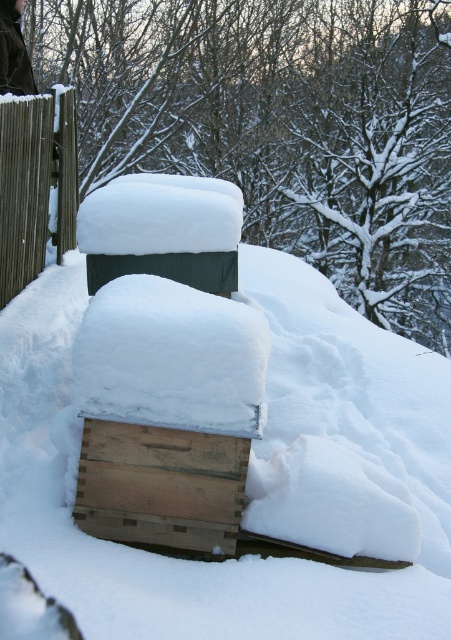
You are a farmer checking on your winter supplies. You see a wooden crate at center and a brown wooden fence at left. Which object is closer to you?

The wooden crate at center is positioned under the brown wooden fence at left, meaning it is closer to you than the fence.

You are standing at the point marked as point (x=161, y=484). What object is located exactly at your current position?

The wooden crate at center is located exactly at point (x=161, y=484).

You are standing at the center of the image. You need to place a wooden crate at center. Where should you place it?

You should place the wooden crate at center at point (161, 484).